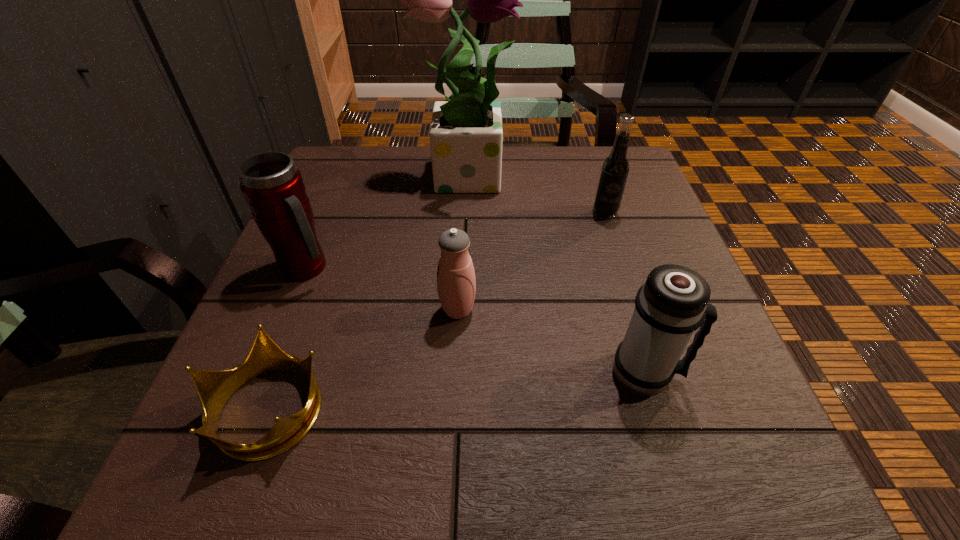
I want to click on free location located on the label of the fifth nearest object, so click(x=628, y=284).

You are a GUI agent. You are given a task and a screenshot of the screen. Output one action in this format:
    pyautogui.click(x=<x>, y=<y>)
    Task: Click on the vacant area situated 0.070m on the side with the handle of the farthest thermos bottle
    The image size is (960, 540).
    Given the screenshot: What is the action you would take?
    pyautogui.click(x=371, y=268)

Where is `free space located 0.060m on the side with the handle of the rightmost thermos bottle`? This screenshot has height=540, width=960. free space located 0.060m on the side with the handle of the rightmost thermos bottle is located at coordinates (717, 373).

Identify the location of free space located on the right of the second nearest thermos bottle. (579, 310).

This screenshot has width=960, height=540. Identify the location of vacant area located 0.310m on the right of the crown. (538, 408).

You are a GUI agent. You are given a task and a screenshot of the screen. Output one action in this format:
    pyautogui.click(x=<x>, y=<y>)
    Task: Click on the object positioned at the far edge
    This screenshot has width=960, height=540.
    Given the screenshot: What is the action you would take?
    pyautogui.click(x=466, y=135)

You are a GUI agent. You are given a task and a screenshot of the screen. Output one action in this format:
    pyautogui.click(x=<x>, y=<y>)
    Task: Click on the object that is at the near edge
    This screenshot has height=540, width=960.
    Given the screenshot: What is the action you would take?
    pyautogui.click(x=214, y=388)

I want to click on thermos bottle located at the left edge, so click(272, 186).

Identify the location of crown at the left edge. [x=214, y=388].

Locate an element on the screen. root beer situated at the right edge is located at coordinates tap(615, 167).